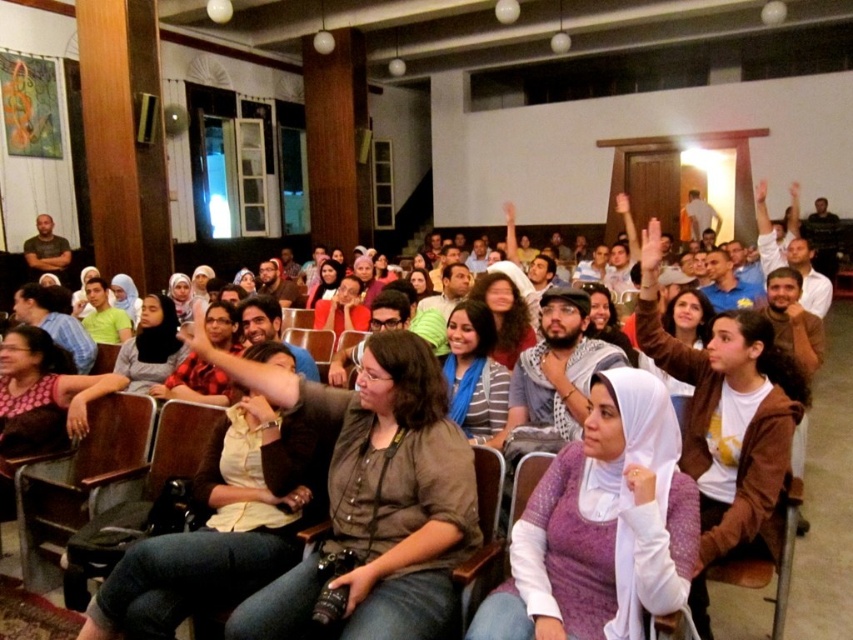
You are organizing a photo shoot and need to arrange two models wearing the purple knit sweater at center and the matte black shirt at center. Based on the scene description, which model should stand closer to the camera to ensure both appear the same size in the photo?

The purple knit sweater at center is smaller in size compared to the matte black shirt at center. To make them appear the same size in the photo, the model wearing the purple knit sweater at center should stand closer to the camera.

You are organizing a photo shoot and need to arrange the brown fabric jacket at center and the matte black shirt at left in a display case that is 1.2 meters wide. Can both items fit side by side without overlapping?

The brown fabric jacket at center might be wider than matte black shirt at left, so it is uncertain if both can fit side by side in a 1.2 meter wide display case without overlapping. Measure both items to confirm.

In the scene shown: You are sitting in the front row of the conference hall and notice two people wearing a purple knit sweater at center and a matte black shirt at center. Which one is sitting closer to you?

The purple knit sweater at center is closer to the viewer than the matte black shirt at center, so the person wearing the purple knit sweater at center is sitting closer to you.